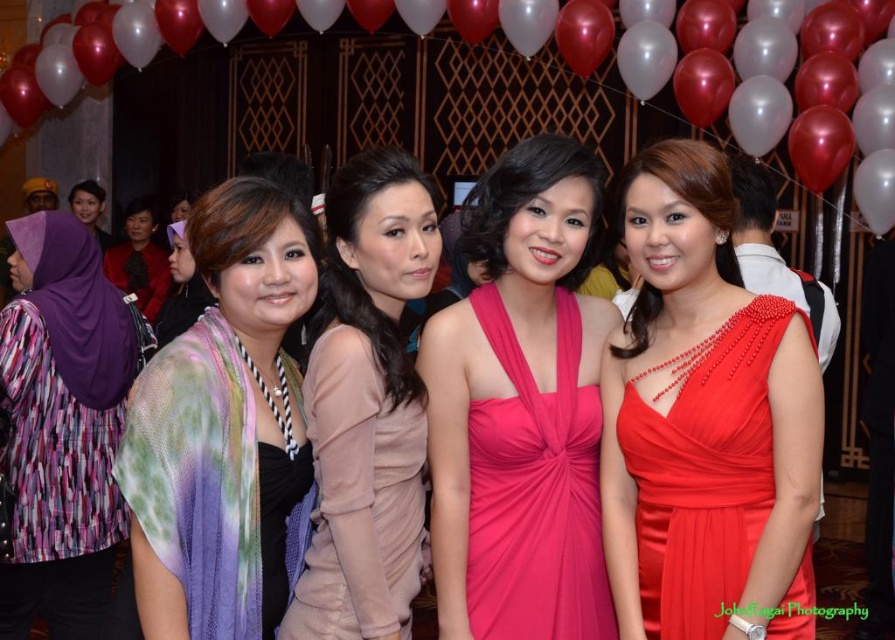
You are a photographer at the event and need to adjust the lighting to ensure both the fuchsia satin dress at center and the matte beige dress at center are well lit. Given their sizes, which dress might require more space in the frame to avoid being cut off?

The fuchsia satin dress at center has a larger width than the matte beige dress at center, so it might require more space in the frame to avoid being cut off.